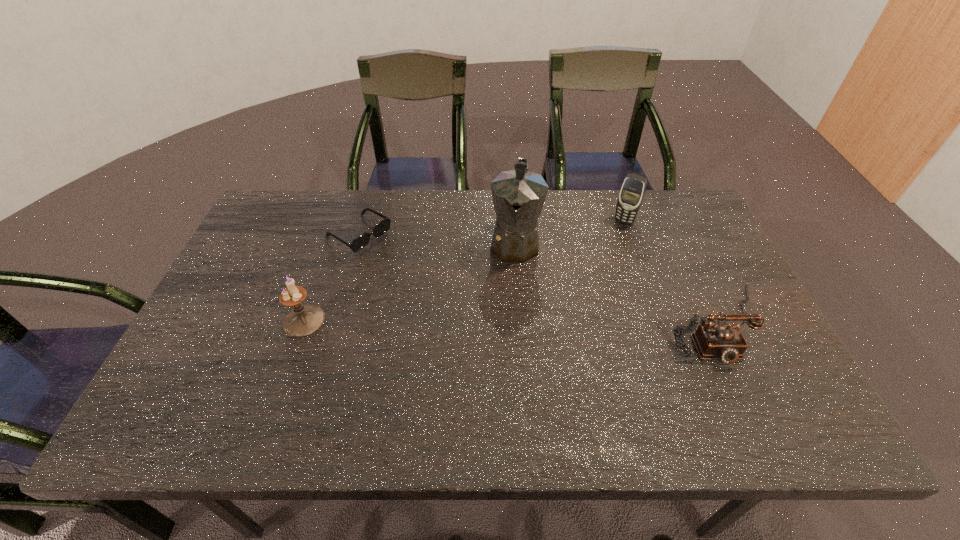
Find the location of a particular element. vacant spot on the desktop that is between the candle holder and the fourth tallest object and is positioned on the pouring side of the third object from left to right is located at coordinates (504, 322).

Where is `free space on the desktop that is between the candle holder and the telephone and is positioned on the front-facing side of the sunglasses`? free space on the desktop that is between the candle holder and the telephone and is positioned on the front-facing side of the sunglasses is located at coordinates (503, 322).

Where is `free space on the desktop that is between the candle holder and the telephone and is positioned on the front face of the cellular telephone`? This screenshot has width=960, height=540. free space on the desktop that is between the candle holder and the telephone and is positioned on the front face of the cellular telephone is located at coordinates (564, 322).